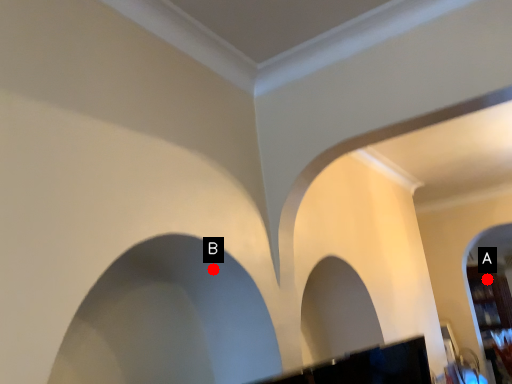
Question: Two points are circled on the image, labeled by A and B beside each circle. Which point is closer to the camera taking this photo?

Choices:
 (A) A is closer
 (B) B is closer

Answer: (B)